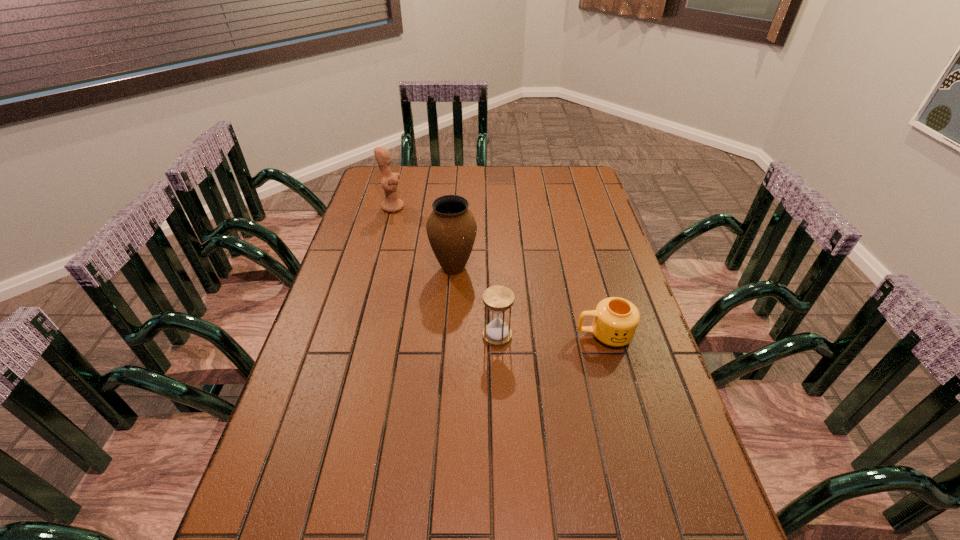
Find the location of a particular element. This screenshot has height=540, width=960. vacant region that satisfies the following two spatial constraints: 1. on the front-facing side of the second object from left to right; 2. on the right side of the farthest object is located at coordinates (377, 268).

The image size is (960, 540). Find the location of `blank space that satisfies the following two spatial constraints: 1. on the front-facing side of the farthest object; 2. on the right side of the second object from left to right`. blank space that satisfies the following two spatial constraints: 1. on the front-facing side of the farthest object; 2. on the right side of the second object from left to right is located at coordinates (377, 268).

Where is `vacant space that satisfies the following two spatial constraints: 1. on the front-facing side of the figurine; 2. on the back side of the third object from right to left`? vacant space that satisfies the following two spatial constraints: 1. on the front-facing side of the figurine; 2. on the back side of the third object from right to left is located at coordinates (377, 268).

Where is `free region that satisfies the following two spatial constraints: 1. on the front side of the third object from left to right; 2. on the right side of the third object from right to left`? The height and width of the screenshot is (540, 960). free region that satisfies the following two spatial constraints: 1. on the front side of the third object from left to right; 2. on the right side of the third object from right to left is located at coordinates coord(449,336).

Image resolution: width=960 pixels, height=540 pixels. Find the location of `blank area in the image that satisfies the following two spatial constraints: 1. on the back side of the hourglass; 2. on the front-facing side of the farthest object`. blank area in the image that satisfies the following two spatial constraints: 1. on the back side of the hourglass; 2. on the front-facing side of the farthest object is located at coordinates (492, 207).

Where is `free region that satisfies the following two spatial constraints: 1. on the back side of the third object from left to right; 2. on the front-facing side of the figurine`? free region that satisfies the following two spatial constraints: 1. on the back side of the third object from left to right; 2. on the front-facing side of the figurine is located at coordinates (492, 207).